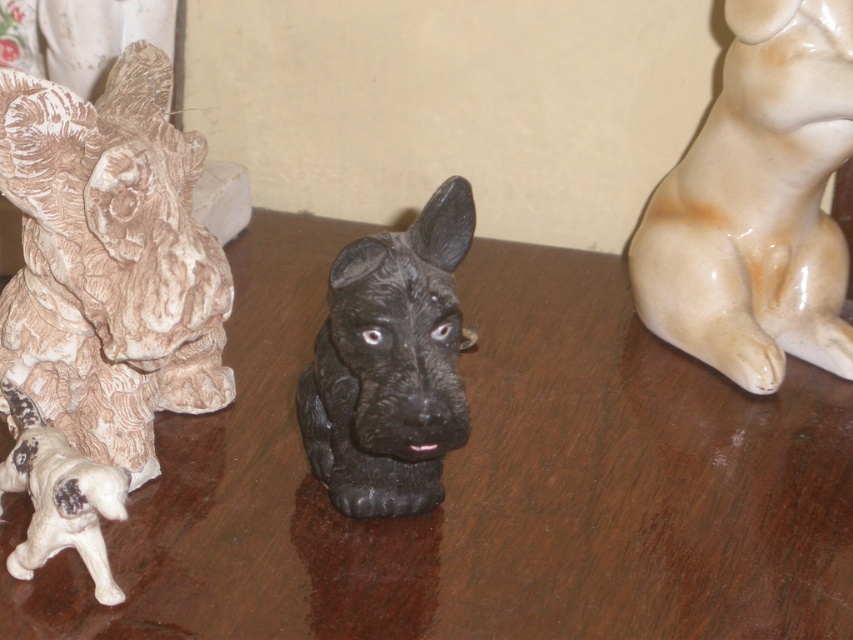
Question: Among these points, which one is farthest from the camera?

Choices:
 (A) (567, 557)
 (B) (637, 314)
 (C) (18, 353)
 (D) (10, 484)

Answer: (B)

Question: Considering the real-world distances, which object is closest to the black matte dog at center?

Choices:
 (A) white textured dog at left
 (B) shiny brown table at center
 (C) matte white dog at right
 (D) white matte dog at lower left

Answer: (A)

Question: Does white textured dog at left appear over black matte dog at center?

Choices:
 (A) yes
 (B) no

Answer: (A)

Question: Which point is closer to the camera?

Choices:
 (A) (24, 269)
 (B) (70, 513)
 (C) (397, 330)

Answer: (B)

Question: Can you confirm if matte white dog at right is positioned above black matte dog at center?

Choices:
 (A) yes
 (B) no

Answer: (A)

Question: Does shiny brown table at center have a larger size compared to black matte dog at center?

Choices:
 (A) no
 (B) yes

Answer: (B)